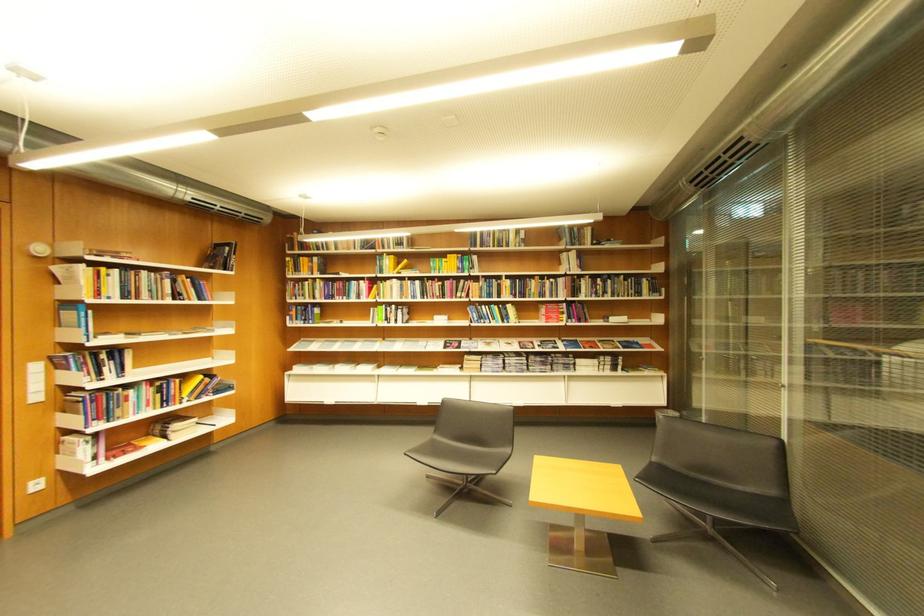
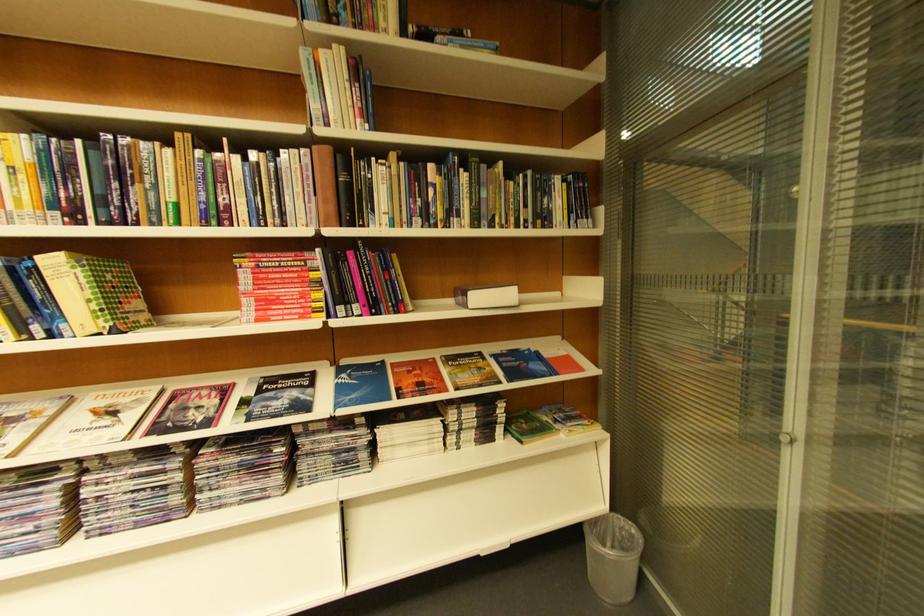
Find the pixel in the second image that matches point (561, 308) in the first image.

(281, 262)